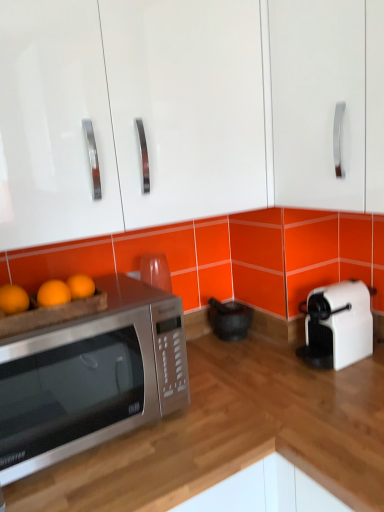
You are a GUI agent. You are given a task and a screenshot of the screen. Output one action in this format:
    pyautogui.click(x=<x>, y=<y>)
    Task: Click on the white plastic toaster at right
    This screenshot has height=512, width=384.
    Given the screenshot: What is the action you would take?
    pyautogui.click(x=337, y=325)

The image size is (384, 512). What do you see at coordinates (127, 114) in the screenshot?
I see `glossy white cabinet at upper center, positioned as the second cabinetry in right-to-left order` at bounding box center [127, 114].

At what (x,y) coordinates should I click in order to perform the action: click on satin silver microwave at left. Please return your answer as a coordinate pair (x, y). The image size is (384, 512). Looking at the image, I should click on (91, 377).

The height and width of the screenshot is (512, 384). Identify the location of white glossy cabinet handle at upper right, which is the first cabinetry from right to left. (327, 103).

This screenshot has width=384, height=512. Identify the location of white plastic toaster at right. (337, 325).

From the picture: Between white plastic toaster at right and white glossy cabinet handle at upper right, which is the first cabinetry from right to left, which one has larger size?

white glossy cabinet handle at upper right, which is the first cabinetry from right to left.

From the white plastic toaster at right, count 1st cabinetrys forward and point to it. Please provide its 2D coordinates.

[(327, 103)]

Is white plastic toaster at right not inside white glossy cabinet handle at upper right, which is the first cabinetry from right to left?

Indeed, white plastic toaster at right is completely outside white glossy cabinet handle at upper right, which is the first cabinetry from right to left.

Considering the relative sizes of black matte mortar and pestle at center and glossy white cabinet at upper center, positioned as the second cabinetry in right-to-left order, in the image provided, is black matte mortar and pestle at center thinner than glossy white cabinet at upper center, positioned as the second cabinetry in right-to-left order,?

Correct, the width of black matte mortar and pestle at center is less than that of glossy white cabinet at upper center, positioned as the second cabinetry in right-to-left order.

Are black matte mortar and pestle at center and glossy white cabinet at upper center, positioned as the second cabinetry in right-to-left order, located far from each other?

Actually, black matte mortar and pestle at center and glossy white cabinet at upper center, positioned as the second cabinetry in right-to-left order, are a little close together.

From the image's perspective, is black matte mortar and pestle at center below glossy white cabinet at upper center, positioned as the second cabinetry in right-to-left order?

Indeed, from the image's perspective, black matte mortar and pestle at center is shown beneath glossy white cabinet at upper center, positioned as the second cabinetry in right-to-left order.

Between black matte mortar and pestle at center and silver metallic microwave at lower left, which one has more height?

Standing taller between the two is silver metallic microwave at lower left.

Considering the positions of points (240, 327) and (237, 450), is point (240, 327) farther from camera compared to point (237, 450)?

Yes, it is.

Where is `counter top on the left side of black matte mortar and pestle at center`? Image resolution: width=384 pixels, height=512 pixels. counter top on the left side of black matte mortar and pestle at center is located at coordinates (235, 428).

Are glossy white cabinet at upper center, placed as the 1th cabinetry when sorted from left to right, and white plastic toaster at right located far from each other?

No.

Is point (215, 70) more distant than point (305, 348)?

No, (215, 70) is in front of (305, 348).

From a real-world perspective, is glossy white cabinet at upper center, placed as the 1th cabinetry when sorted from left to right, located higher than white plastic toaster at right?

Yes, from a real-world perspective, glossy white cabinet at upper center, placed as the 1th cabinetry when sorted from left to right, is above white plastic toaster at right.

The height and width of the screenshot is (512, 384). In order to click on the 2nd cabinetry directly above the white plastic toaster at right (from a real-world perspective) in this screenshot , I will do `click(127, 114)`.

Is black matte mortar and pestle at center looking in the opposite direction of satin silver microwave at left?

No, black matte mortar and pestle at center's orientation is not away from satin silver microwave at left.

Can you confirm if black matte mortar and pestle at center is smaller than satin silver microwave at left?

Yes, black matte mortar and pestle at center is smaller than satin silver microwave at left.

Is black matte mortar and pestle at center with satin silver microwave at left?

No, black matte mortar and pestle at center is not with satin silver microwave at left.

Is black matte mortar and pestle at center behind satin silver microwave at left?

That is True.

Are white plastic toaster at right and black matte mortar and pestle at center beside each other?

white plastic toaster at right and black matte mortar and pestle at center are clearly separated.

Can you confirm if white plastic toaster at right is smaller than black matte mortar and pestle at center?

No, white plastic toaster at right is not smaller than black matte mortar and pestle at center.

Locate an element on the screen. This screenshot has height=512, width=384. toaster lying on the right of black matte mortar and pestle at center is located at coordinates (337, 325).

From the image's perspective, who appears lower, white plastic toaster at right or black matte mortar and pestle at center?

black matte mortar and pestle at center.

Based on the photo, is white glossy cabinet handle at upper right, acting as the second cabinetry starting from the left, outside of black matte mortar and pestle at center?

Yes.

Is white glossy cabinet handle at upper right, acting as the second cabinetry starting from the left, bigger or smaller than black matte mortar and pestle at center?

Clearly, white glossy cabinet handle at upper right, acting as the second cabinetry starting from the left, is larger in size than black matte mortar and pestle at center.

Where is `appliance located behind the white glossy cabinet handle at upper right, acting as the second cabinetry starting from the left`? This screenshot has height=512, width=384. appliance located behind the white glossy cabinet handle at upper right, acting as the second cabinetry starting from the left is located at coordinates (229, 319).

The image size is (384, 512). In order to click on the 1st cabinetry to the left of the white plastic toaster at right, counting from the anchor's position in this screenshot , I will do `click(327, 103)`.

The height and width of the screenshot is (512, 384). I want to click on appliance behind the glossy white cabinet at upper center, positioned as the second cabinetry in right-to-left order, so click(229, 319).

Based on their spatial positions, is silver metallic microwave at lower left or satin silver microwave at left further from glossy white cabinet at upper center, placed as the 1th cabinetry when sorted from left to right?

Among the two, silver metallic microwave at lower left is located further to glossy white cabinet at upper center, placed as the 1th cabinetry when sorted from left to right.

Considering their positions, is black matte mortar and pestle at center positioned further to white plastic toaster at right than white glossy cabinet handle at upper right, which is the first cabinetry from right to left?

white glossy cabinet handle at upper right, which is the first cabinetry from right to left, lies further to white plastic toaster at right than the other object.

From the picture: Which object lies further to the anchor point satin silver microwave at left, glossy white cabinet at upper center, placed as the 1th cabinetry when sorted from left to right, or white glossy cabinet handle at upper right, acting as the second cabinetry starting from the left?

white glossy cabinet handle at upper right, acting as the second cabinetry starting from the left, is positioned further to the anchor satin silver microwave at left.

From the image, which object appears to be farther from black matte mortar and pestle at center, white glossy cabinet handle at upper right, which is the first cabinetry from right to left, or silver metallic microwave at lower left?

white glossy cabinet handle at upper right, which is the first cabinetry from right to left.

Considering their positions, is satin silver microwave at left positioned further to white glossy cabinet handle at upper right, acting as the second cabinetry starting from the left, than glossy white cabinet at upper center, positioned as the second cabinetry in right-to-left order?

satin silver microwave at left lies further to white glossy cabinet handle at upper right, acting as the second cabinetry starting from the left, than the other object.

Estimate the real-world distances between objects in this image. Which object is further from white glossy cabinet handle at upper right, acting as the second cabinetry starting from the left, white plastic toaster at right or silver metallic microwave at lower left?

Among the two, silver metallic microwave at lower left is located further to white glossy cabinet handle at upper right, acting as the second cabinetry starting from the left.

Based on their spatial positions, is glossy white cabinet at upper center, positioned as the second cabinetry in right-to-left order, or white plastic toaster at right closer to silver metallic microwave at lower left?

white plastic toaster at right is positioned closer to the anchor silver metallic microwave at lower left.

Estimate the real-world distances between objects in this image. Which object is further from black matte mortar and pestle at center, glossy white cabinet at upper center, placed as the 1th cabinetry when sorted from left to right, or silver metallic microwave at lower left?

glossy white cabinet at upper center, placed as the 1th cabinetry when sorted from left to right, is further to black matte mortar and pestle at center.

Image resolution: width=384 pixels, height=512 pixels. Identify the location of toaster that lies between glossy white cabinet at upper center, placed as the 1th cabinetry when sorted from left to right, and black matte mortar and pestle at center from top to bottom. (337, 325).

Identify the location of toaster between white glossy cabinet handle at upper right, which is the first cabinetry from right to left, and silver metallic microwave at lower left vertically. This screenshot has width=384, height=512. (337, 325).

The height and width of the screenshot is (512, 384). I want to click on appliance that lies between white glossy cabinet handle at upper right, which is the first cabinetry from right to left, and silver metallic microwave at lower left from top to bottom, so click(x=229, y=319).

Locate an element on the screen. This screenshot has height=512, width=384. toaster between glossy white cabinet at upper center, positioned as the second cabinetry in right-to-left order, and silver metallic microwave at lower left in the up-down direction is located at coordinates (337, 325).